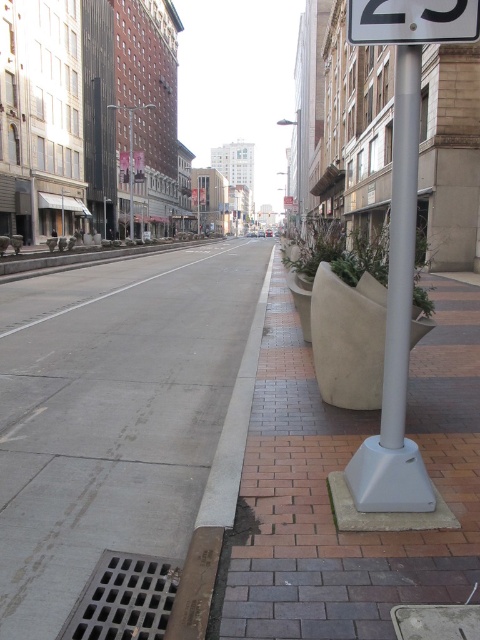
Does white smooth pole at right have a smaller size compared to gray concrete curb at center?

Yes.

Between point (405, 384) and point (226, 422), which one is positioned behind?

Point (226, 422)

I want to click on white smooth pole at right, so click(x=400, y=243).

Is gray concrete sidewalk at center thinner than white smooth pole at right?

Incorrect, gray concrete sidewalk at center's width is not less than white smooth pole at right's.

Between gray concrete sidewalk at center and white smooth pole at right, which one is positioned higher?

gray concrete sidewalk at center

Is point (58, 488) closer to camera compared to point (409, 211)?

No, it is not.

The width and height of the screenshot is (480, 640). In order to click on gray concrete sidewalk at center in this screenshot , I will do `click(112, 417)`.

Does gray concrete sidewalk at center appear over gray concrete curb at center?

Yes.

Locate an element on the screen. gray concrete sidewalk at center is located at coordinates (112, 417).